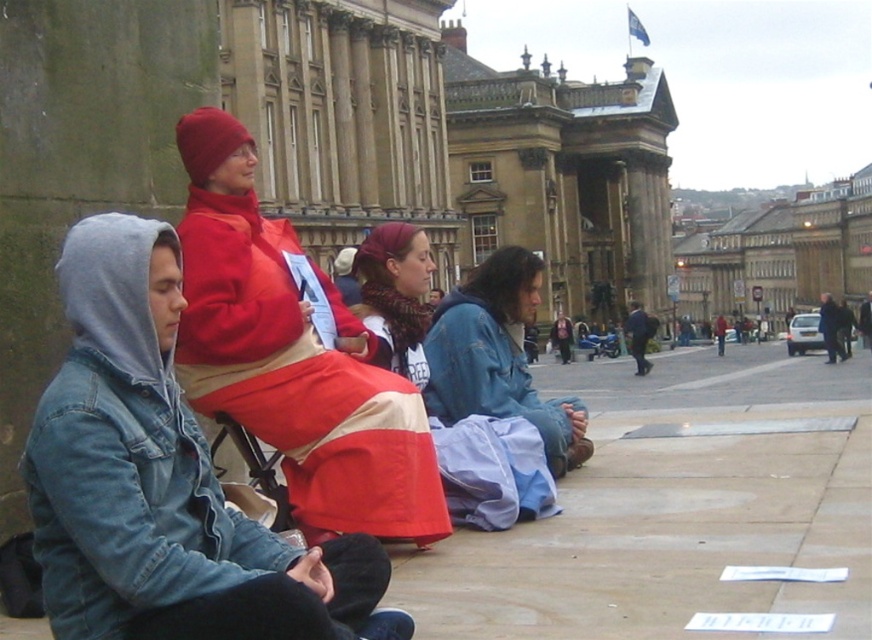
You are a photographer trying to capture a candid shot of the knitted red scarf at center without obstructing the blue denim jacket at center. Is the scarf currently visible in the frame?

The knitted red scarf at center is behind the blue denim jacket at center, so it may not be fully visible in the frame if the jacket is blocking it.

You are standing in the plaza and want to take a photo of both the historic building and the group of people. You notice two points marked in the scene at coordinates point [509,388] and point [383,259]. Which point should you focus on to ensure both the building and the people are in sharp focus?

You should focus on point 0.405, 0440 because it is farther from the camera, allowing both the historic building in the background and the group of people in the foreground to be in focus.

You are a photographer trying to capture a group photo of the denim jacket at left and the matte red coat at center. To ensure both are in the frame, should you position yourself to the left or right of the group?

You should position yourself to the right of the group because the denim jacket at left is to the left of the matte red coat at center, so standing to the right would keep both in the frame.